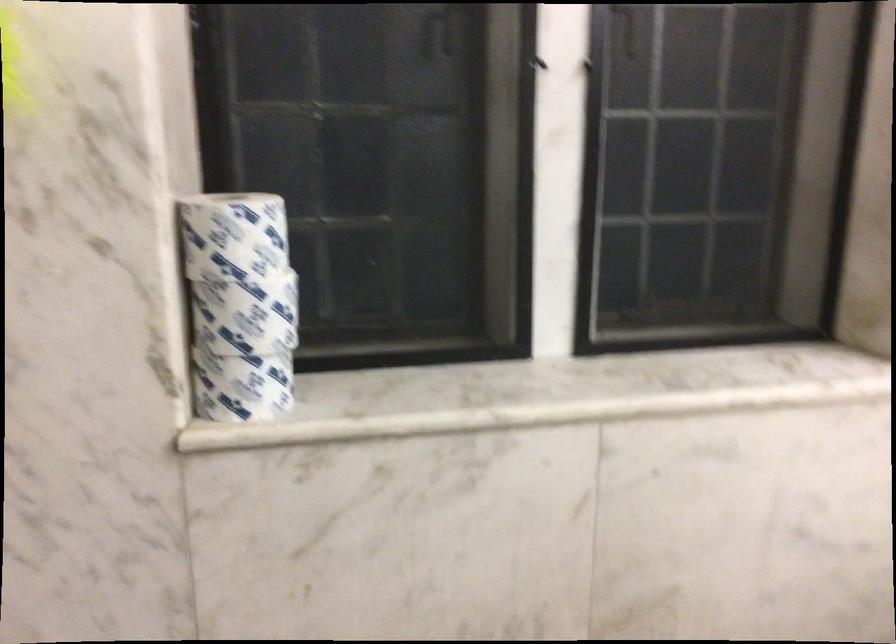
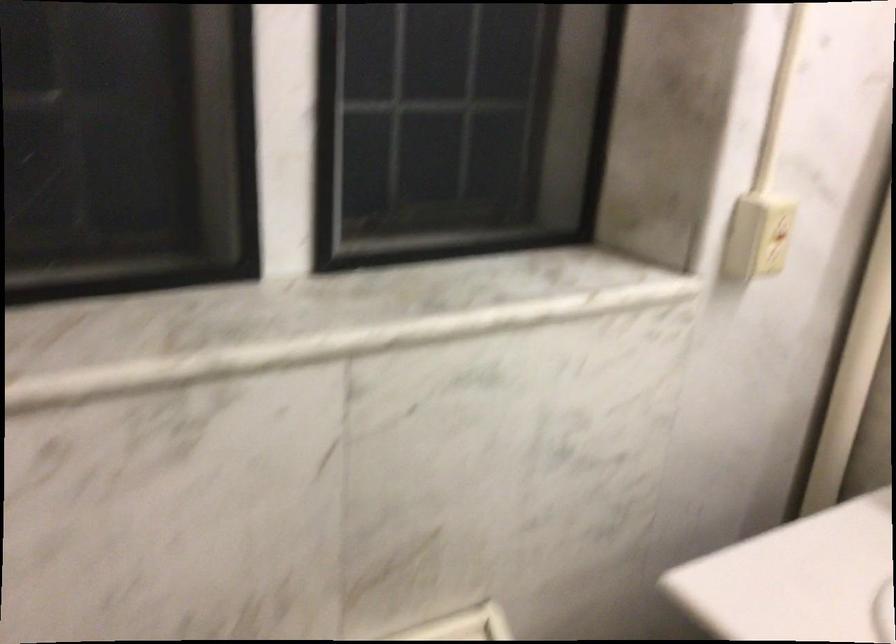
Question: In a continuous first-person perspective shot, in which direction is the camera moving?

Choices:
 (A) Left
 (B) Right
 (C) Forward
 (D) Backward

Answer: (C)